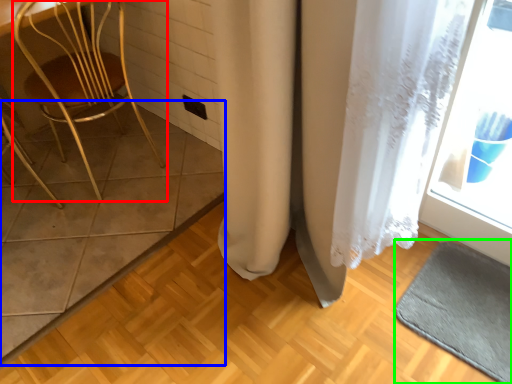
Question: Based on their relative distances, which object is farther from chair (highlighted by a red box)? Choose from tile (highlighted by a blue box) and bath mat (highlighted by a green box).

Choices:
 (A) tile
 (B) bath mat

Answer: (B)